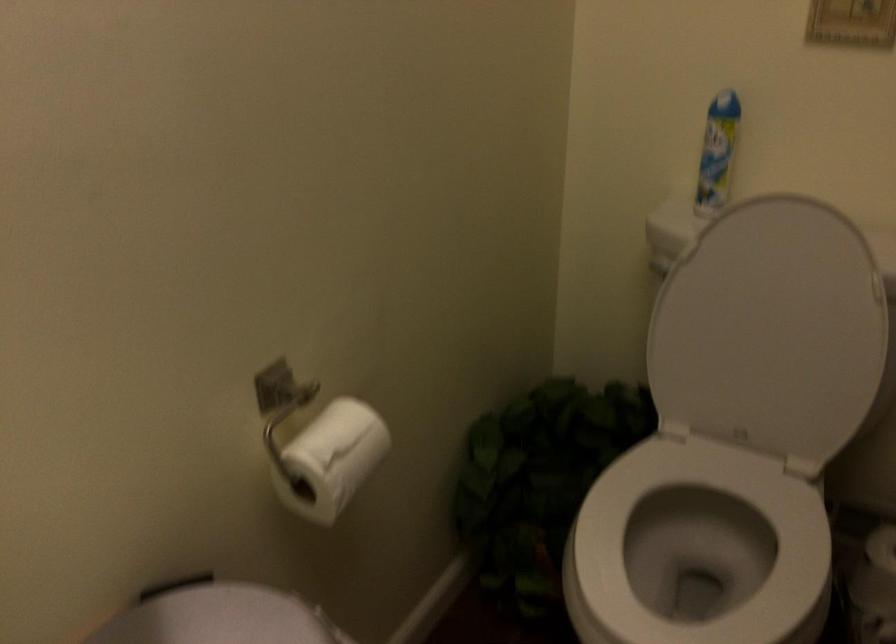
This screenshot has width=896, height=644. What do you see at coordinates (729, 96) in the screenshot?
I see `a aerosol can nozzle` at bounding box center [729, 96].